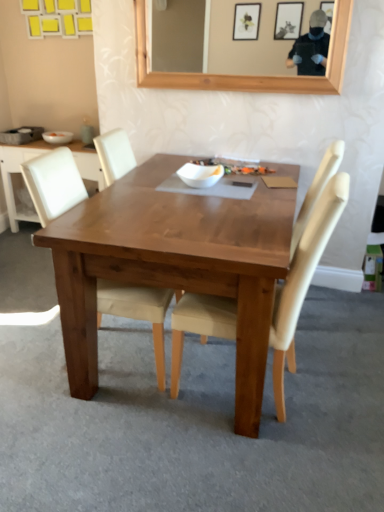
Question: Does light beige fabric chair at center, which is counted as the 2th chair, starting from the right, have a lesser width compared to matte gray coffee cup at upper left?

Choices:
 (A) no
 (B) yes

Answer: (A)

Question: From a real-world perspective, is light beige fabric chair at center, which appears as the 1th chair when viewed from the left, on top of matte gray coffee cup at upper left?

Choices:
 (A) yes
 (B) no

Answer: (B)

Question: Is light beige fabric chair at center, which appears as the 1th chair when viewed from the left, in front of matte gray coffee cup at upper left?

Choices:
 (A) no
 (B) yes

Answer: (B)

Question: Considering the relative positions of light beige fabric chair at center, which appears as the 1th chair when viewed from the left, and matte gray coffee cup at upper left in the image provided, is light beige fabric chair at center, which appears as the 1th chair when viewed from the left, to the left of matte gray coffee cup at upper left from the viewer's perspective?

Choices:
 (A) yes
 (B) no

Answer: (B)

Question: From a real-world perspective, is light beige fabric chair at center, which is counted as the 2th chair, starting from the right, under matte gray coffee cup at upper left?

Choices:
 (A) yes
 (B) no

Answer: (A)

Question: From their relative heights in the image, would you say light beige fabric chair at center, which appears as the 1th chair when viewed from the left, is taller or shorter than beige fabric chair at center, the 1th chair in the right-to-left sequence?

Choices:
 (A) tall
 (B) short

Answer: (A)

Question: From the image's perspective, is light beige fabric chair at center, which appears as the 1th chair when viewed from the left, located above or below beige fabric chair at center, the 1th chair in the right-to-left sequence?

Choices:
 (A) below
 (B) above

Answer: (B)

Question: Is point (157, 293) positioned closer to the camera than point (216, 311)?

Choices:
 (A) closer
 (B) farther

Answer: (B)

Question: Considering their positions, is light beige fabric chair at center, which is counted as the 2th chair, starting from the right, located in front of or behind beige fabric chair at center, acting as the second chair starting from the left?

Choices:
 (A) behind
 (B) front

Answer: (A)

Question: Considering the positions of point (182, 302) and point (77, 206), is point (182, 302) closer or farther from the camera than point (77, 206)?

Choices:
 (A) farther
 (B) closer

Answer: (B)

Question: Relative to wooden table at center, is beige fabric chair at center, the 1th chair in the right-to-left sequence, in front or behind?

Choices:
 (A) front
 (B) behind

Answer: (A)

Question: Considering the positions of beige fabric chair at center, the 1th chair in the right-to-left sequence, and wooden table at center in the image, is beige fabric chair at center, the 1th chair in the right-to-left sequence, bigger or smaller than wooden table at center?

Choices:
 (A) small
 (B) big

Answer: (A)

Question: From their relative heights in the image, would you say beige fabric chair at center, the 1th chair in the right-to-left sequence, is taller or shorter than wooden table at center?

Choices:
 (A) short
 (B) tall

Answer: (B)

Question: Based on their sizes in the image, would you say wooden table at center is bigger or smaller than white matte bowl at center, placed as the 1th bowl when sorted from front to back?

Choices:
 (A) small
 (B) big

Answer: (B)

Question: Looking at their shapes, would you say wooden table at center is wider or thinner than white matte bowl at center, which appears as the first bowl when ordered from the bottom?

Choices:
 (A) thin
 (B) wide

Answer: (B)